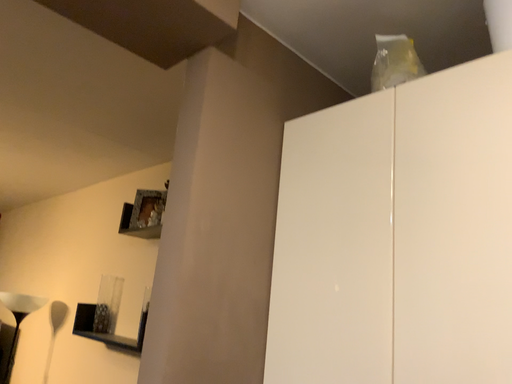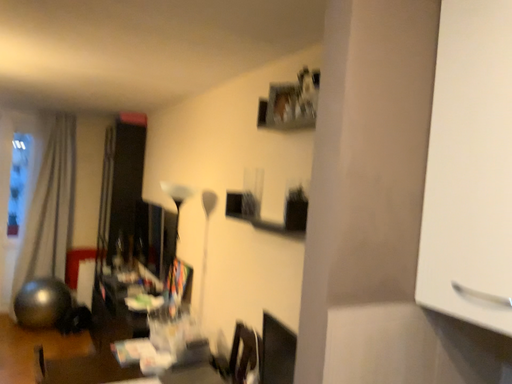
Question: Which way did the camera rotate in the video?

Choices:
 (A) rotated downward
 (B) rotated upward

Answer: (A)